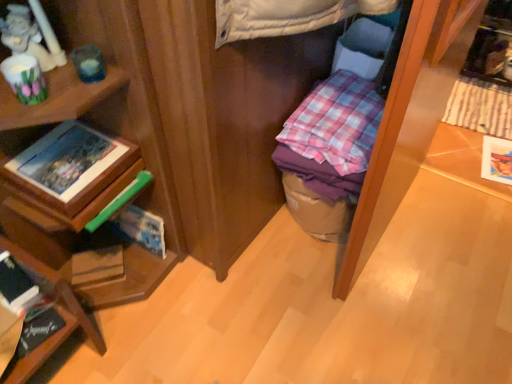
Question: In the image, is matte brown book at lower left, which is the second paperback book in front-to-back order, positioned in front of or behind pink checkered fabric at center?

Choices:
 (A) behind
 (B) front

Answer: (A)

Question: Considering the positions of point (102, 264) and point (356, 94), is point (102, 264) closer or farther from the camera than point (356, 94)?

Choices:
 (A) closer
 (B) farther

Answer: (B)

Question: Which is nearer to the wooden bookshelf at lower left?

Choices:
 (A) wooden photo frame at left, arranged as the 1th book when viewed from the top
 (B) matte brown book at lower left, which ranks as the first paperback book in bottom-to-top order
 (C) pink checkered fabric at center
 (D) matte paper paperback book at right, the third paperback book positioned from the left
 (E) hardcover book at left, placed as the 2th paperback book when sorted from right to left

Answer: (B)

Question: Which is farther from the wooden bookshelf at lower left?

Choices:
 (A) hardcover book at lower left, the 2th book in the bottom-to-top sequence
 (B) hardcover book at left, positioned as the 1th paperback book in front-to-back order
 (C) matte paper paperback book at right, acting as the 3th paperback book starting from the front
 (D) hardcover book at lower left, the third book when ordered from top to bottom
 (E) matte brown book at lower left, which is the first paperback book from left to right

Answer: (C)